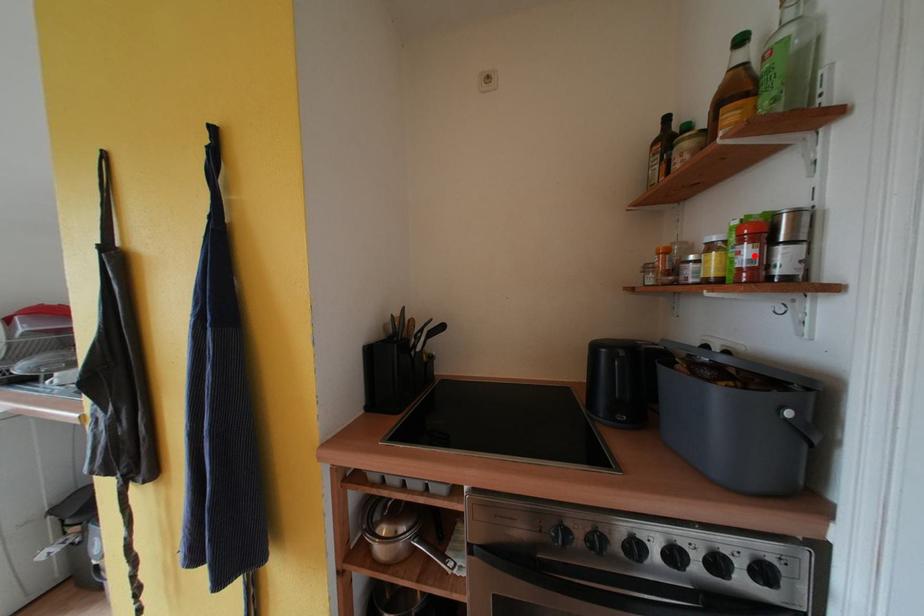
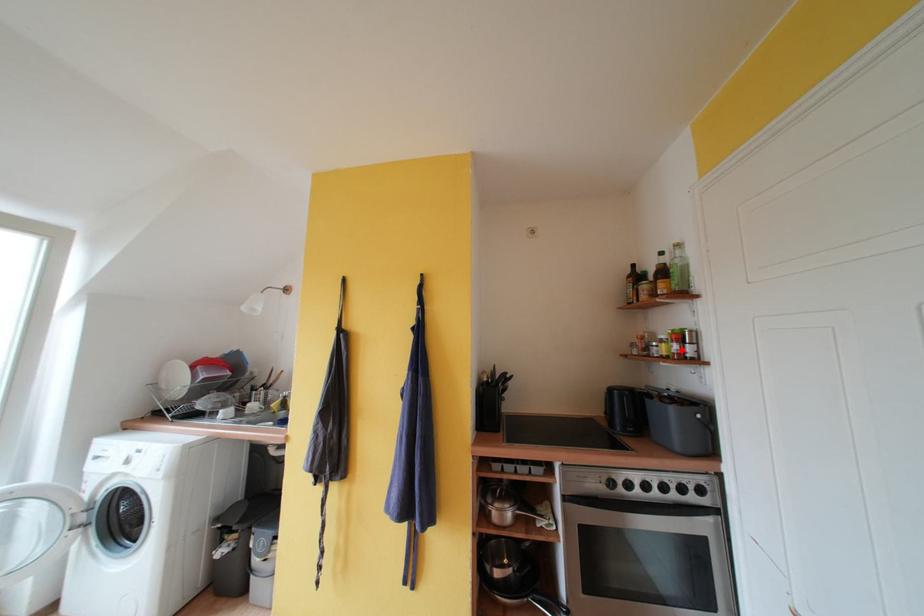
I am providing you with two images of the same scene from different viewpoints. A red point is marked on the first image and another point is marked on the second image. Do the highlighted points in image1 and image2 indicate the same real-world spot?

Yes